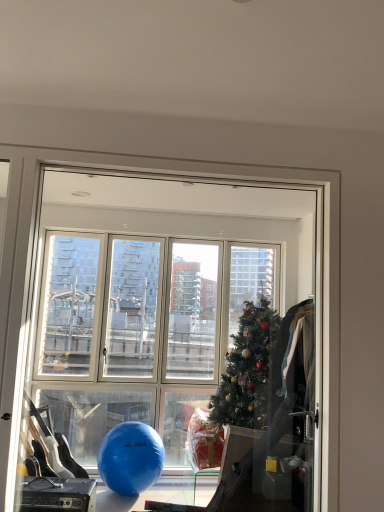
Where is `empty space that is ontop of clear glass window at center (from a real-world perspective)`? The height and width of the screenshot is (512, 384). empty space that is ontop of clear glass window at center (from a real-world perspective) is located at coordinates (154, 168).